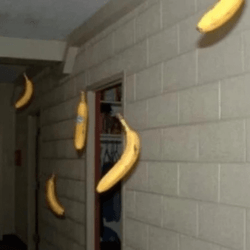
Where is `ceiling`? ceiling is located at coordinates (40, 18), (66, 11).